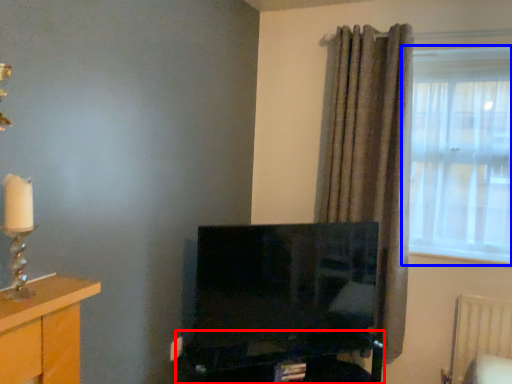
Question: Which object appears closest to the camera in this image, computer desk (highlighted by a red box) or window (highlighted by a blue box)?

Choices:
 (A) computer desk
 (B) window

Answer: (A)